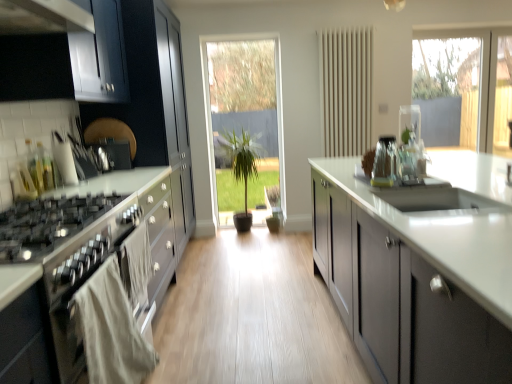
Question: From a real-world perspective, is clear glass vase at upper center, acting as the second appliance starting from the front, physically below matte gray cabinets at center, the 2th cabinetry when ordered from back to front?

Choices:
 (A) yes
 (B) no

Answer: (B)

Question: Would you say clear glass vase at upper center, the second appliance viewed from the back, contains matte gray cabinets at center, the 1th cabinetry in the front-to-back sequence?

Choices:
 (A) yes
 (B) no

Answer: (B)

Question: Can you confirm if clear glass vase at upper center, the second appliance viewed from the back, is smaller than matte gray cabinets at center, the 1th cabinetry in the front-to-back sequence?

Choices:
 (A) yes
 (B) no

Answer: (A)

Question: Does clear glass vase at upper center, the 1th appliance from the right, have a greater width compared to matte gray cabinets at center, acting as the second cabinetry starting from the left?

Choices:
 (A) yes
 (B) no

Answer: (B)

Question: From a real-world perspective, is clear glass vase at upper center, acting as the second appliance starting from the front, physically above matte gray cabinets at center, acting as the second cabinetry starting from the left?

Choices:
 (A) no
 (B) yes

Answer: (B)

Question: Is clear glass vase at upper center, which is counted as the third appliance, starting from the left, to the left or to the right of satin black gas stove at left in the image?

Choices:
 (A) left
 (B) right

Answer: (B)

Question: In terms of height, does clear glass vase at upper center, the 1th appliance from the right, look taller or shorter compared to satin black gas stove at left?

Choices:
 (A) tall
 (B) short

Answer: (A)

Question: Looking at their shapes, would you say clear glass vase at upper center, which is counted as the third appliance, starting from the left, is wider or thinner than satin black gas stove at left?

Choices:
 (A) thin
 (B) wide

Answer: (A)

Question: From the image's perspective, is clear glass vase at upper center, acting as the second appliance starting from the front, above or below satin black gas stove at left?

Choices:
 (A) above
 (B) below

Answer: (A)

Question: Is clear glass vase at center, the second appliance when ordered from right to left, situated inside clear glass vase at upper center, the second appliance viewed from the back, or outside?

Choices:
 (A) inside
 (B) outside

Answer: (B)

Question: In the image, is clear glass vase at center, positioned as the second appliance in left-to-right order, positioned in front of or behind clear glass vase at upper center, acting as the second appliance starting from the front?

Choices:
 (A) behind
 (B) front

Answer: (B)

Question: From the image's perspective, is clear glass vase at center, positioned as the second appliance in left-to-right order, located above or below clear glass vase at upper center, the 1th appliance from the right?

Choices:
 (A) above
 (B) below

Answer: (B)

Question: From a real-world perspective, relative to clear glass vase at upper center, the 1th appliance from the right, is clear glass vase at center, positioned as the third appliance in back-to-front order, vertically above or below?

Choices:
 (A) above
 (B) below

Answer: (B)

Question: Considering the positions of matte gray cabinets at center, the 2th cabinetry when ordered from back to front, and clear glass vase at upper center, the 1th appliance from the right, in the image, is matte gray cabinets at center, the 2th cabinetry when ordered from back to front, taller or shorter than clear glass vase at upper center, the 1th appliance from the right,?

Choices:
 (A) short
 (B) tall

Answer: (B)

Question: From a real-world perspective, relative to clear glass vase at upper center, acting as the second appliance starting from the front, is matte gray cabinets at center, which appears as the first cabinetry when viewed from the right, vertically above or below?

Choices:
 (A) below
 (B) above

Answer: (A)